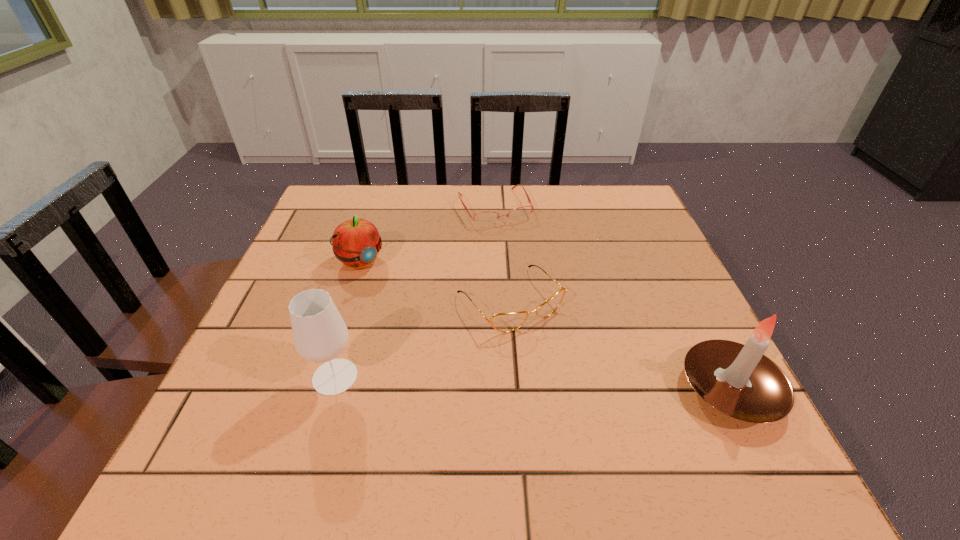
Identify the location of free location located 0.260m on the surface of the apple. The image size is (960, 540). (438, 338).

Where is `vacant region located 0.080m on the surface of the apple`? The image size is (960, 540). vacant region located 0.080m on the surface of the apple is located at coordinates (391, 292).

This screenshot has height=540, width=960. Identify the location of free location located on the front-facing side of the taller spectacles. (573, 372).

Where is `free space located on the front-facing side of the taller spectacles`? free space located on the front-facing side of the taller spectacles is located at coordinates (580, 379).

Find the location of a particular element. This screenshot has width=960, height=540. blank space located 0.180m on the front-facing side of the taller spectacles is located at coordinates (597, 400).

I want to click on vacant space located on the lenses of the shortest object, so click(516, 246).

This screenshot has height=540, width=960. I want to click on vacant space situated on the lenses of the shortest object, so click(x=536, y=285).

At what (x,y) coordinates should I click in order to perform the action: click on free region located 0.150m on the lenses of the shortest object. Please return your answer as a coordinate pair (x, y). Looking at the image, I should click on (x=523, y=261).

Locate an element on the screen. This screenshot has height=540, width=960. object at the far edge is located at coordinates (483, 218).

Locate an element on the screen. glass situated at the near edge is located at coordinates (320, 334).